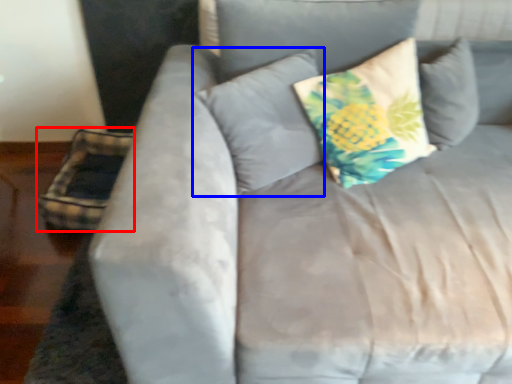
Question: Which point is closer to the camera, pillow (highlighted by a red box) or pillow (highlighted by a blue box)?

Choices:
 (A) pillow
 (B) pillow

Answer: (B)